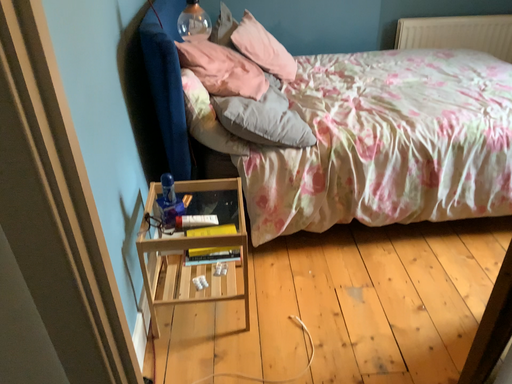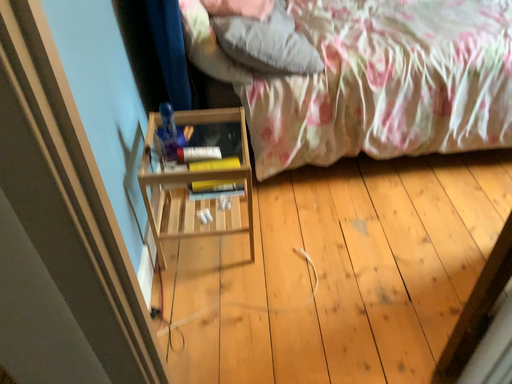
Question: Which way did the camera rotate in the video?

Choices:
 (A) rotated upward
 (B) rotated downward

Answer: (B)